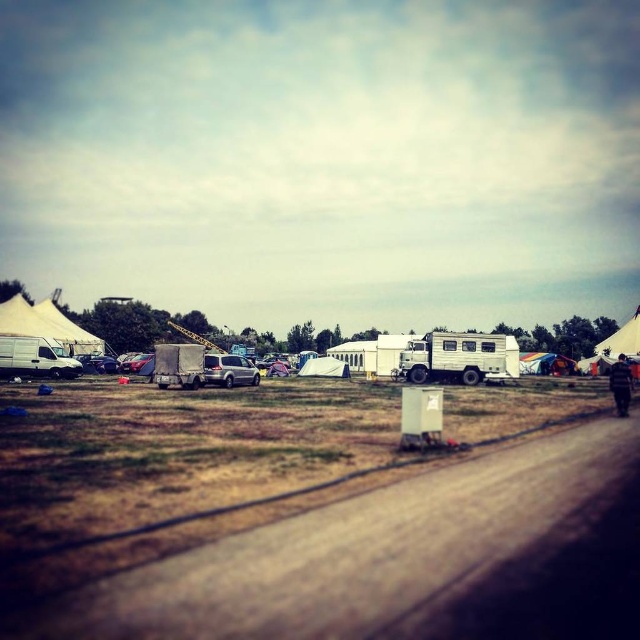
Find the location of `white matte recreational vehicle at center`. white matte recreational vehicle at center is located at coordinates (460, 356).

Does point (35, 349) come behind point (298, 372)?

No, (35, 349) is in front of (298, 372).

Which is more to the right, matte white van at left or white canvas tent at center?

From the viewer's perspective, white canvas tent at center appears more on the right side.

This screenshot has width=640, height=640. I want to click on matte white van at left, so click(x=35, y=356).

Between white canvas tent at right and dark blue fabric person at lower right, which one is positioned lower?

dark blue fabric person at lower right is below.

Can you confirm if white canvas tent at right is bigger than dark blue fabric person at lower right?

Correct, white canvas tent at right is larger in size than dark blue fabric person at lower right.

Is point (628, 323) behind point (621, 385)?

Yes, it is.

You are a GUI agent. You are given a task and a screenshot of the screen. Output one action in this format:
    pyautogui.click(x=<x>, y=<y>)
    Task: Click on the white canvas tent at right
    This screenshot has height=640, width=640.
    Given the screenshot: What is the action you would take?
    pyautogui.click(x=620, y=346)